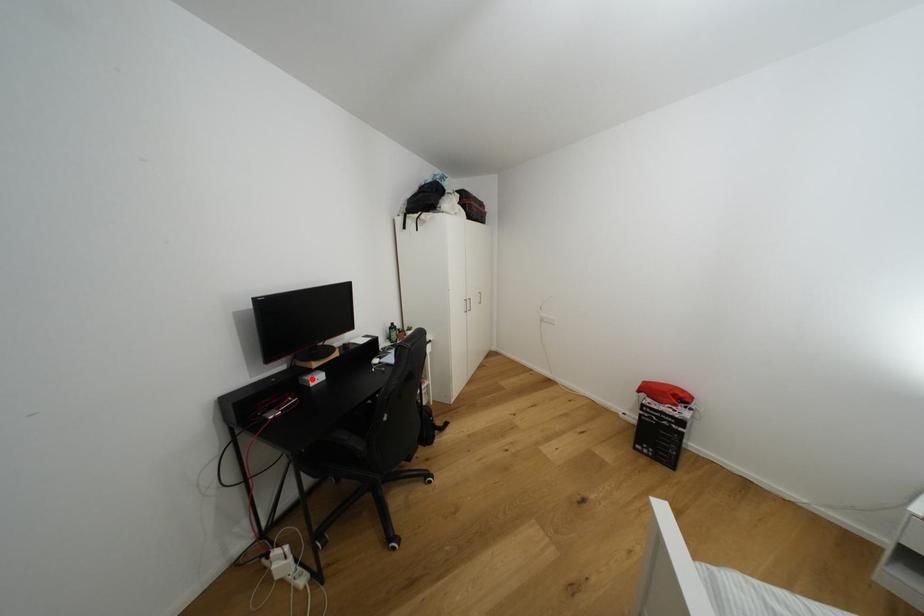
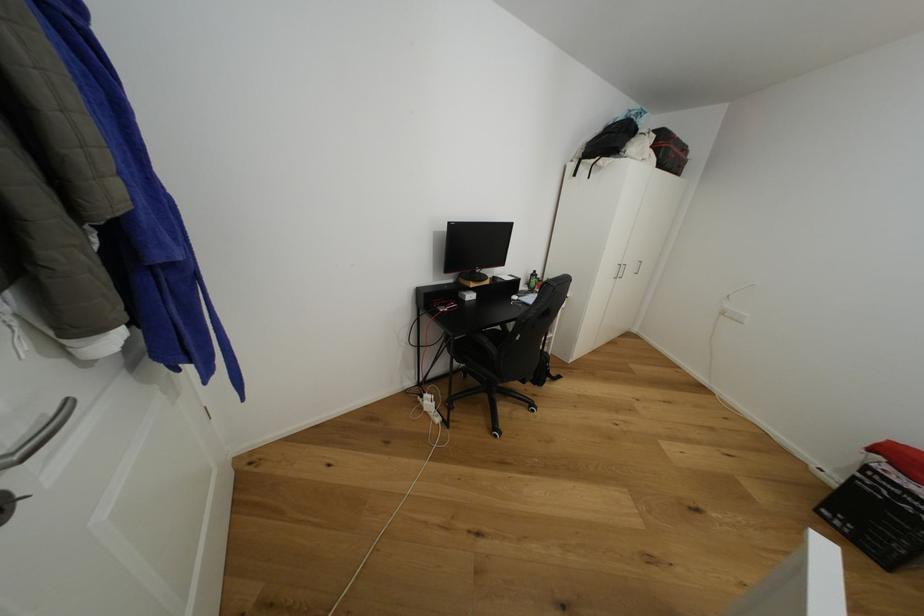
Question: I am providing you with two images of the same scene from different viewpoints. A red point is shown in image1. For the corresponding object point in image2, is it positioned nearer or farther from the camera?

Choices:
 (A) Nearer
 (B) Farther

Answer: (A)